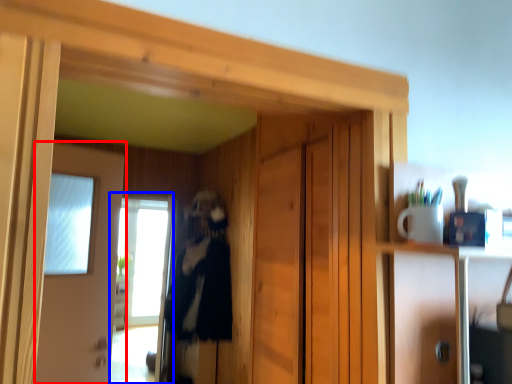
Question: Which of the following is the closest to the observer, door (highlighted by a red box) or screen door (highlighted by a blue box)?

Choices:
 (A) door
 (B) screen door

Answer: (A)